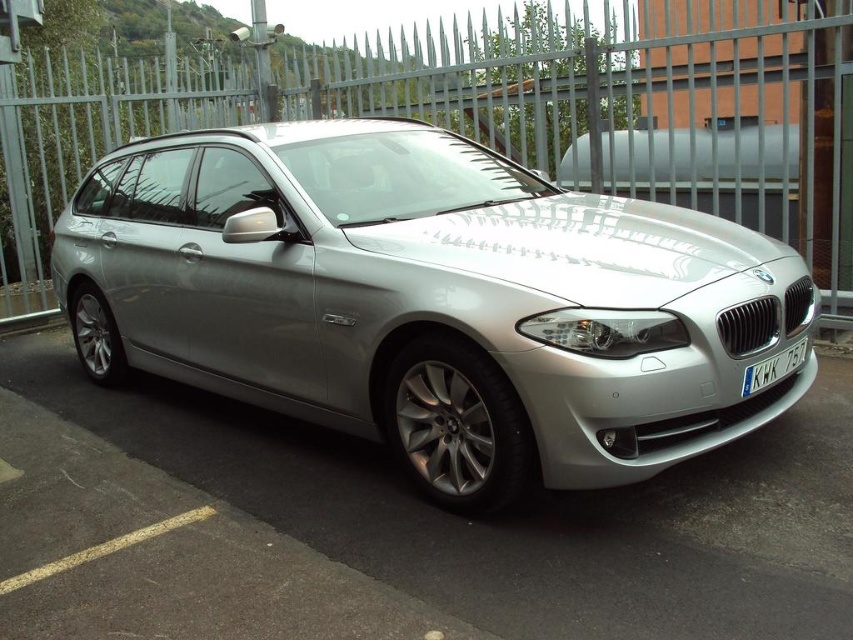
You are a delivery person trying to park your van next to the silver metallic car at center. The van is 2 meters tall. Can you safely park there without hitting the metallic gray fence at center?

The silver metallic car at center has a lesser height compared to the metallic gray fence at center, so the van at 2 meters tall can safely park there without hitting the fence since the fence is taller than the car and the van is as tall as the car.

You are a delivery person trying to park your car in the parking lot. You need to ensure there is enough space between the metallic gray fence at center and the white plastic license plate at front of your car. Based on the image, is there enough space for you to park safely?

The metallic gray fence at center is larger than the white plastic license plate at front, so there should be sufficient space between them for safe parking.